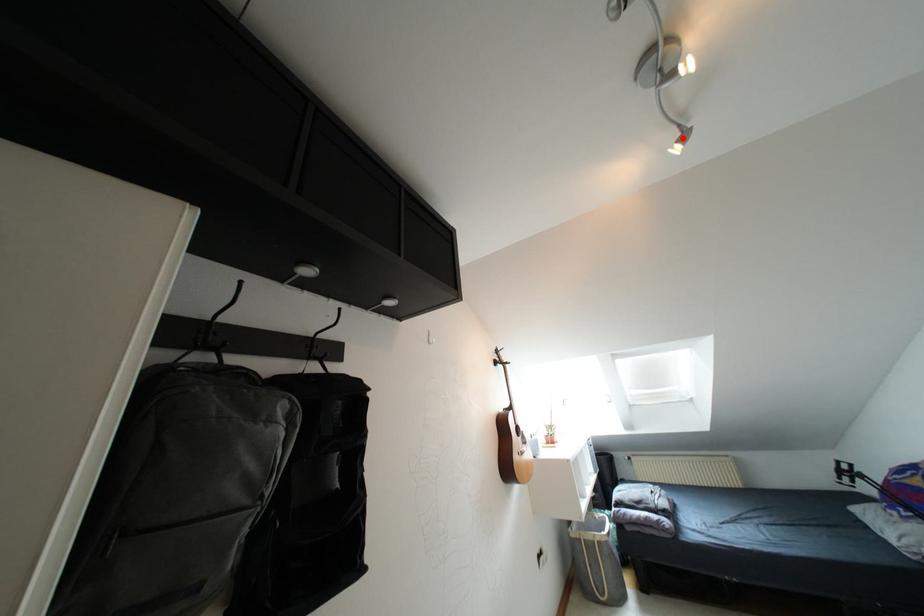
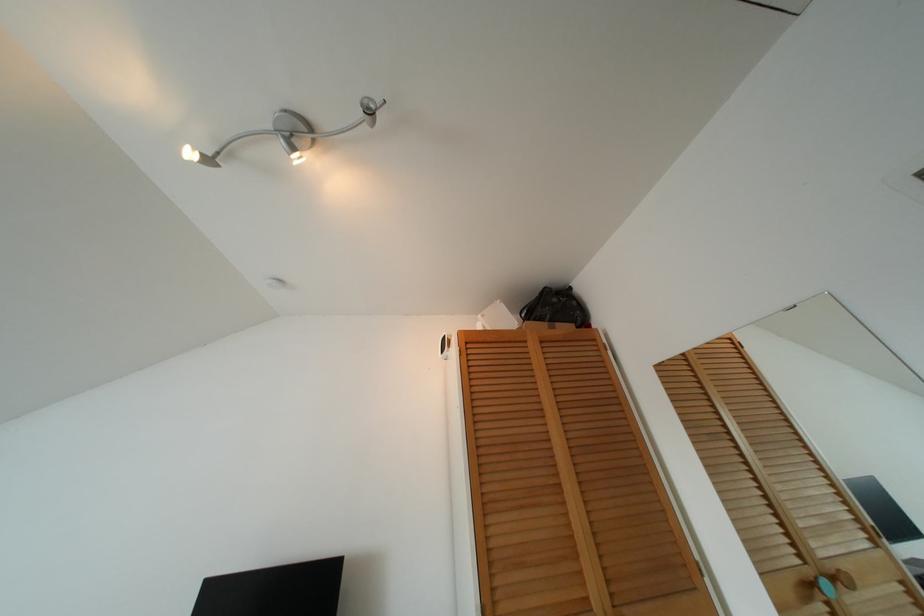
Locate, in the second image, the point that corresponds to the highlighted location in the first image.

(208, 160)